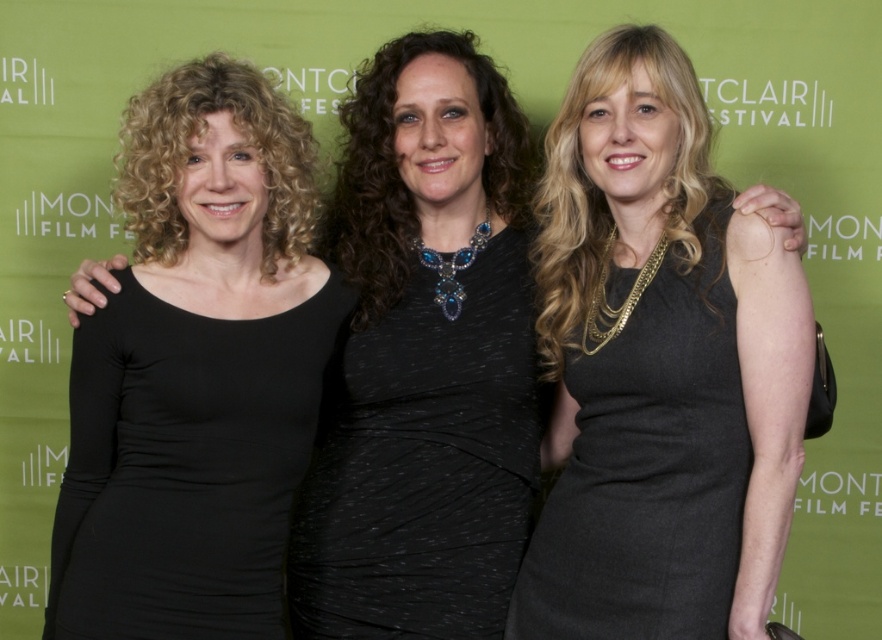
Can you confirm if black matte dress at center is positioned below matte black dress at center?

Yes.

Between black matte dress at center and matte black dress at center, which one is positioned higher?

matte black dress at center is above.

Is point (203, 337) closer to viewer compared to point (574, 550)?

Yes, it is in front of point (574, 550).

Locate an element on the screen. The height and width of the screenshot is (640, 882). black matte dress at center is located at coordinates (184, 467).

Is black textured dress at center shorter than matte black dress at center?

Yes.

How much distance is there between black textured dress at center and matte black dress at center?

A: black textured dress at center is 9.62 inches from matte black dress at center.

Who is more distant from viewer, (x=353, y=483) or (x=626, y=298)?

The point (x=353, y=483) is more distant.

The height and width of the screenshot is (640, 882). What are the coordinates of `black textured dress at center` in the screenshot? It's located at (423, 461).

Does black matte dress at center have a greater width compared to black textured dress at center?

Correct, the width of black matte dress at center exceeds that of black textured dress at center.

Between black matte dress at center and black textured dress at center, which one has more height?

black textured dress at center

Where is `black matte dress at center`? black matte dress at center is located at coordinates (184, 467).